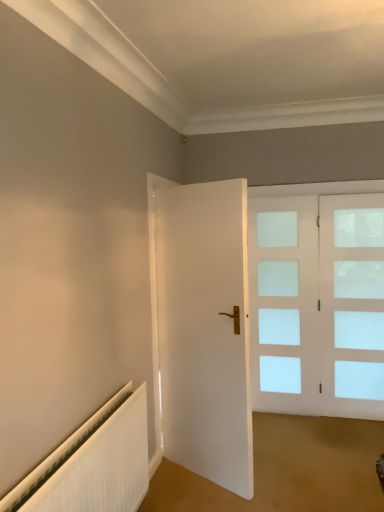
Question: Is white matte door at center positioned with its back to white ribbed radiator at lower left?

Choices:
 (A) yes
 (B) no

Answer: (A)

Question: From the image's perspective, is white matte door at center on top of white ribbed radiator at lower left?

Choices:
 (A) yes
 (B) no

Answer: (A)

Question: From a real-world perspective, is white matte door at center beneath white ribbed radiator at lower left?

Choices:
 (A) yes
 (B) no

Answer: (B)

Question: Does white matte door at center have a greater width compared to white ribbed radiator at lower left?

Choices:
 (A) yes
 (B) no

Answer: (A)

Question: Is white matte door at center thinner than white ribbed radiator at lower left?

Choices:
 (A) no
 (B) yes

Answer: (A)

Question: Is white matte door at center further to the viewer compared to white ribbed radiator at lower left?

Choices:
 (A) yes
 (B) no

Answer: (A)

Question: Considering the relative positions of clear glass door at right and white matte door at center in the image provided, is clear glass door at right to the right of white matte door at center from the viewer's perspective?

Choices:
 (A) yes
 (B) no

Answer: (A)

Question: Is clear glass door at right positioned beyond the bounds of white matte door at center?

Choices:
 (A) no
 (B) yes

Answer: (B)

Question: Is clear glass door at right positioned with its back to white matte door at center?

Choices:
 (A) no
 (B) yes

Answer: (A)

Question: Can you confirm if clear glass door at right is shorter than white matte door at center?

Choices:
 (A) yes
 (B) no

Answer: (A)

Question: From a real-world perspective, is clear glass door at right below white matte door at center?

Choices:
 (A) no
 (B) yes

Answer: (B)

Question: Is white matte door at center inside clear glass door at right?

Choices:
 (A) yes
 (B) no

Answer: (B)

Question: Is white ribbed radiator at lower left looking in the opposite direction of clear glass door at right?

Choices:
 (A) yes
 (B) no

Answer: (B)